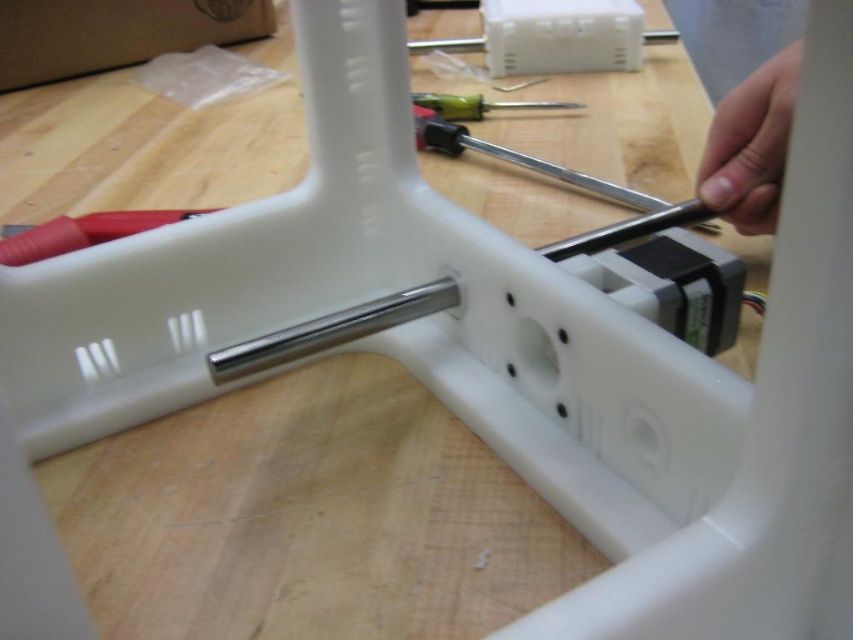
Can you confirm if smooth silver screwdriver at upper right is smaller than green plastic screwdriver at center?

Actually, smooth silver screwdriver at upper right might be larger than green plastic screwdriver at center.

Between point (751, 179) and point (556, 108), which one is positioned in front?

Point (751, 179) is more forward.

At what (x,y) coordinates should I click in order to perform the action: click on smooth silver screwdriver at upper right. Please return your answer as a coordinate pair (x, y). Image resolution: width=853 pixels, height=640 pixels. Looking at the image, I should click on (751, 145).

Who is positioned more to the right, black plastic screwdriver at center or green plastic screwdriver at center?

black plastic screwdriver at center

Does black plastic screwdriver at center have a smaller size compared to green plastic screwdriver at center?

No.

Is point (465, 138) more distant than point (498, 104)?

No, (465, 138) is closer to viewer.

Locate an element on the screen. This screenshot has height=640, width=853. black plastic screwdriver at center is located at coordinates (515, 157).

Between smooth silver screwdriver at upper right and black plastic screwdriver at center, which one is positioned higher?

black plastic screwdriver at center is above.

The image size is (853, 640). What do you see at coordinates (751, 145) in the screenshot? I see `smooth silver screwdriver at upper right` at bounding box center [751, 145].

Measure the distance between smooth silver screwdriver at upper right and camera.

smooth silver screwdriver at upper right is 20.84 inches from camera.

At what (x,y) coordinates should I click in order to perform the action: click on smooth silver screwdriver at upper right. Please return your answer as a coordinate pair (x, y). The width and height of the screenshot is (853, 640). Looking at the image, I should click on (751, 145).